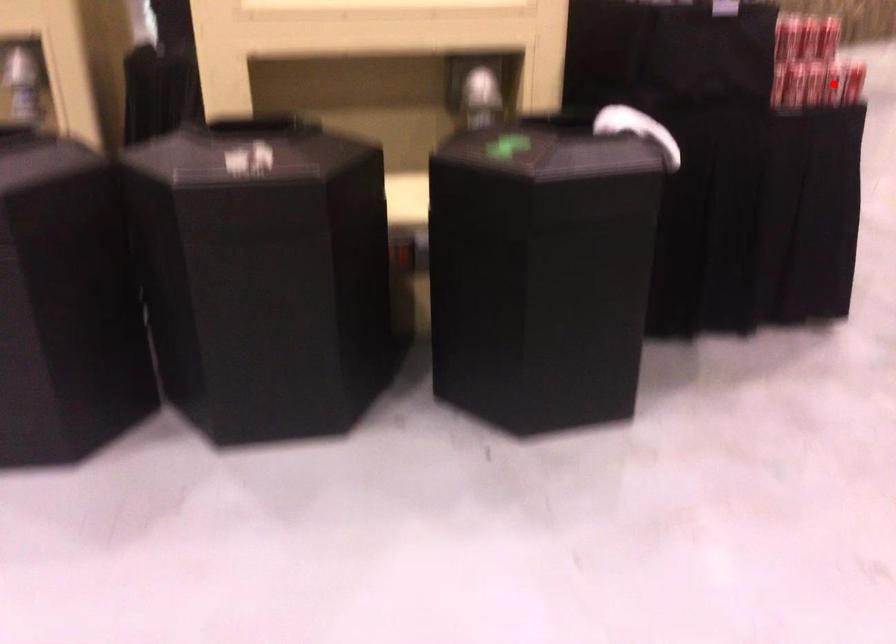
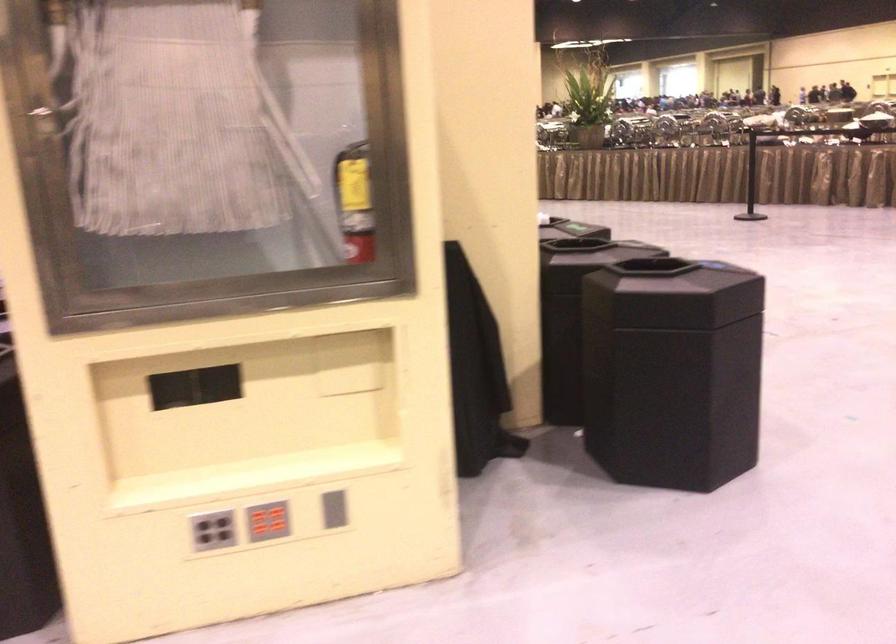
Question: I am providing you with two images of the same scene from different viewpoints. A red point is marked on the first image. Is the red point's position out of view in image 2?

Choices:
 (A) Yes
 (B) No

Answer: (A)